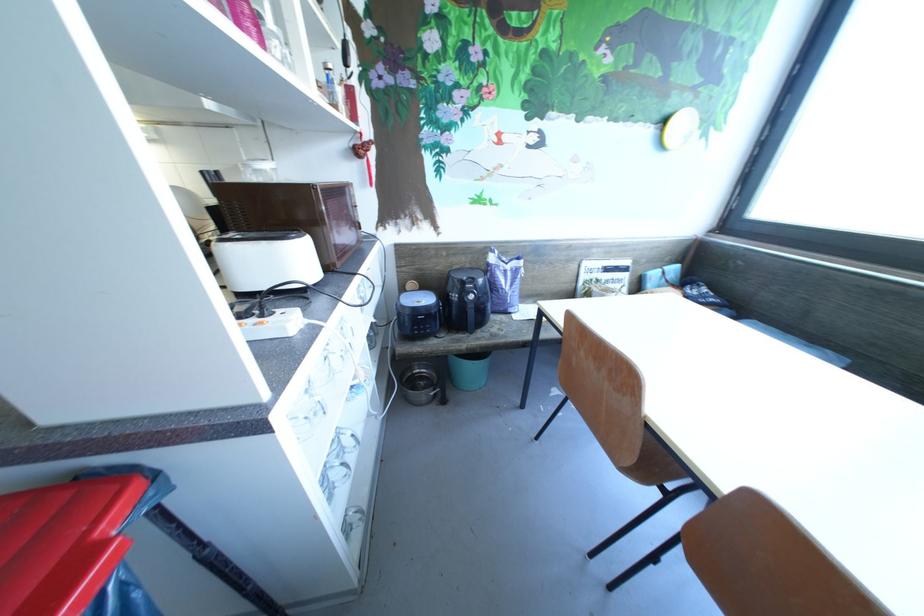
Locate an element on the screen. The image size is (924, 616). blue bucket is located at coordinates (468, 370).